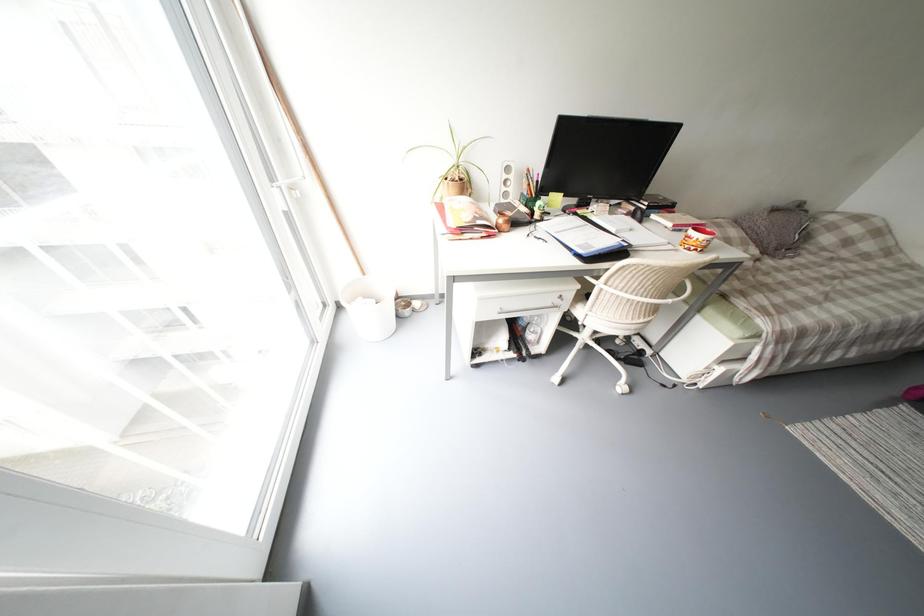
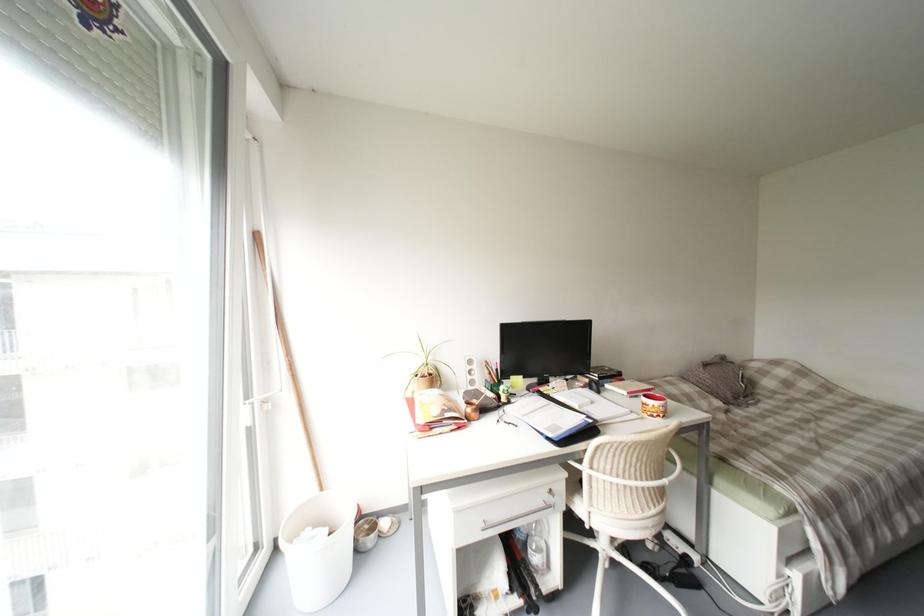
Question: The images are taken continuously from a first-person perspective. In which direction is your viewpoint rotating?

Choices:
 (A) Left
 (B) Right
 (C) Up
 (D) Down

Answer: (C)